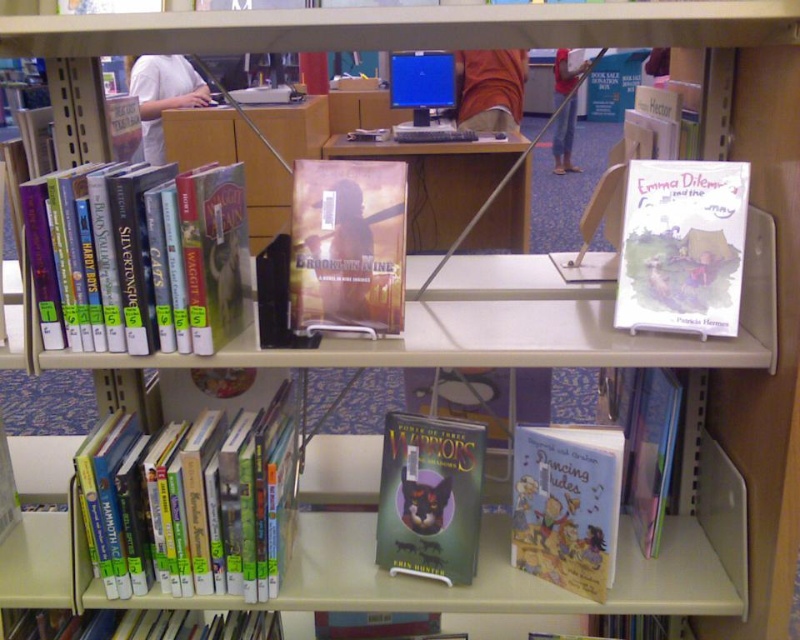
Is matte brown book at center above hardcover book at lower center?

Yes.

Looking at this image, does matte brown book at center appear under hardcover book at lower center?

No.

Image resolution: width=800 pixels, height=640 pixels. I want to click on matte brown book at center, so click(x=348, y=246).

Is hardcover book at lower center below green matte book at center?

Indeed, hardcover book at lower center is positioned under green matte book at center.

Can you confirm if hardcover book at lower center is bigger than green matte book at center?

Actually, hardcover book at lower center might be smaller than green matte book at center.

Describe the element at coordinates (566, 506) in the screenshot. I see `hardcover book at lower center` at that location.

Locate an element on the screen. hardcover book at lower center is located at coordinates (566, 506).

Can you confirm if hardcover books at lower left is bigger than white paper book at upper right?

Correct, hardcover books at lower left is larger in size than white paper book at upper right.

Measure the distance between hardcover books at lower left and white paper book at upper right.

27.39 inches

The height and width of the screenshot is (640, 800). Describe the element at coordinates (196, 497) in the screenshot. I see `hardcover books at lower left` at that location.

Image resolution: width=800 pixels, height=640 pixels. I want to click on hardcover books at lower left, so click(x=196, y=497).